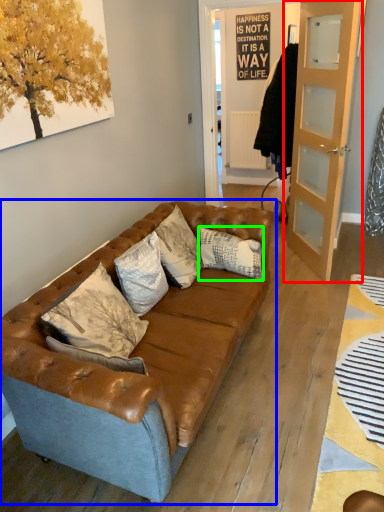
Question: Considering the real-world distances, which object is farthest from door (highlighted by a red box)? studio couch (highlighted by a blue box) or pillow (highlighted by a green box)?

Choices:
 (A) studio couch
 (B) pillow

Answer: (A)